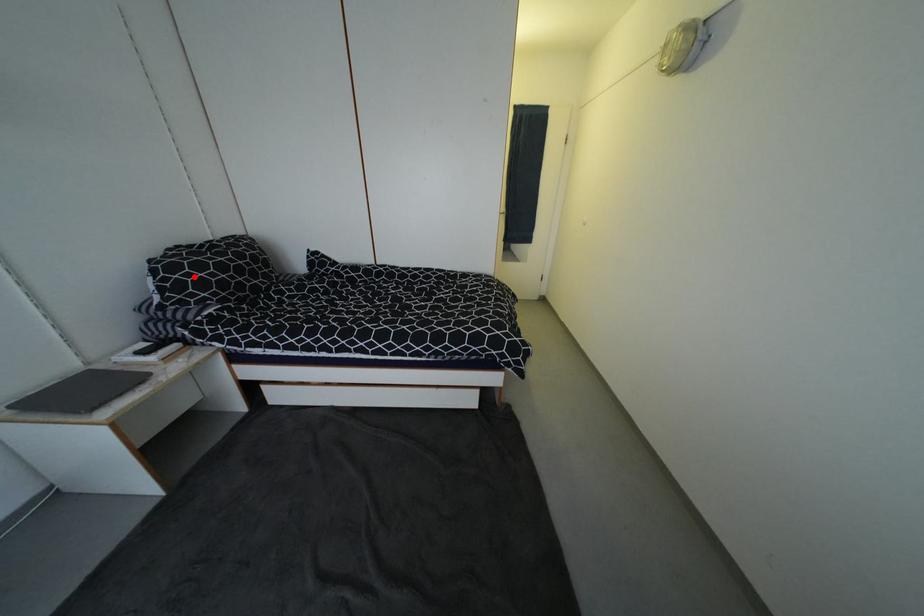
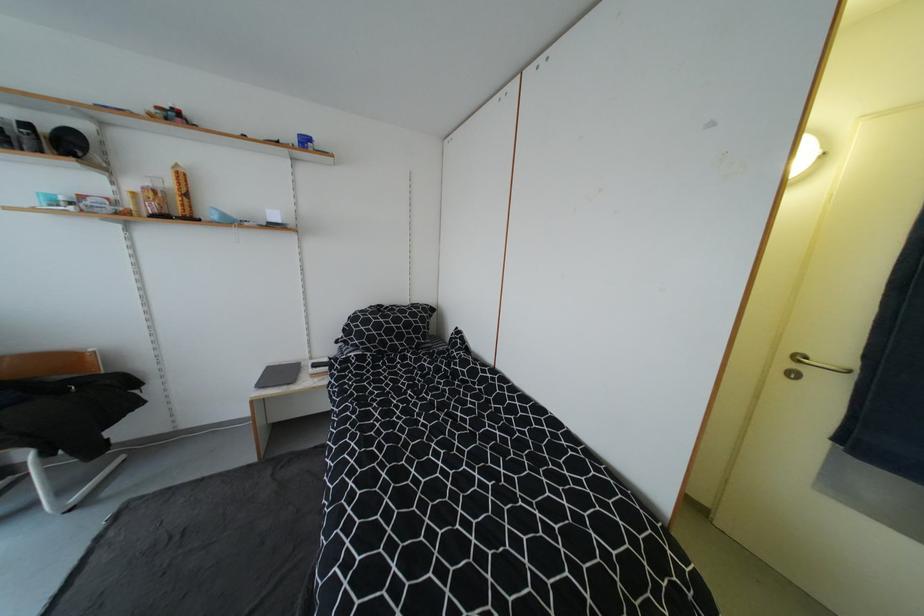
Question: I am providing you with two images of the same scene from different viewpoints. A red point is marked on the first image. At the location where the point appears in image 1, is it still visible in image 2?

Choices:
 (A) Yes
 (B) No

Answer: (A)